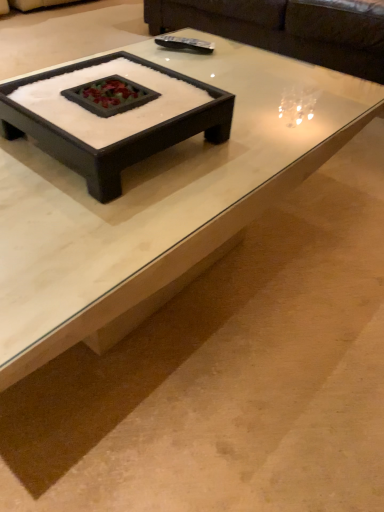
Question: Is dark brown leather couch at upper center oriented away from black matte tray at center, the second coffee table in the front-to-back sequence?

Choices:
 (A) yes
 (B) no

Answer: (B)

Question: Considering the relative sizes of dark brown leather couch at upper center and black matte tray at center, the second coffee table in the front-to-back sequence, in the image provided, is dark brown leather couch at upper center taller than black matte tray at center, the second coffee table in the front-to-back sequence,?

Choices:
 (A) yes
 (B) no

Answer: (A)

Question: Is dark brown leather couch at upper center closer to the viewer compared to black matte tray at center, the second coffee table in the front-to-back sequence?

Choices:
 (A) no
 (B) yes

Answer: (A)

Question: Does dark brown leather couch at upper center appear on the right side of black matte tray at center, placed as the 1th coffee table when sorted from back to front?

Choices:
 (A) no
 (B) yes

Answer: (B)

Question: Can you confirm if dark brown leather couch at upper center is thinner than black matte tray at center, the second coffee table in the front-to-back sequence?

Choices:
 (A) no
 (B) yes

Answer: (A)

Question: From a real-world perspective, is dark brown leather couch at upper center above or below white glossy coffee table at center, the 2th coffee table viewed from the back?

Choices:
 (A) below
 (B) above

Answer: (B)

Question: Is dark brown leather couch at upper center in front of or behind white glossy coffee table at center, the 2th coffee table viewed from the back, in the image?

Choices:
 (A) behind
 (B) front

Answer: (A)

Question: Looking at their shapes, would you say dark brown leather couch at upper center is wider or thinner than white glossy coffee table at center, the 2th coffee table viewed from the back?

Choices:
 (A) thin
 (B) wide

Answer: (B)

Question: Considering the positions of dark brown leather couch at upper center and white glossy coffee table at center, which appears as the first coffee table when viewed from the front, in the image, is dark brown leather couch at upper center bigger or smaller than white glossy coffee table at center, which appears as the first coffee table when viewed from the front,?

Choices:
 (A) small
 (B) big

Answer: (B)

Question: Is black matte tray at center, placed as the 1th coffee table when sorted from back to front, taller or shorter than dark brown leather couch at upper center?

Choices:
 (A) short
 (B) tall

Answer: (A)

Question: Does point (231, 112) appear closer or farther from the camera than point (190, 26)?

Choices:
 (A) farther
 (B) closer

Answer: (B)

Question: From a real-world perspective, is black matte tray at center, the second coffee table in the front-to-back sequence, positioned above or below dark brown leather couch at upper center?

Choices:
 (A) above
 (B) below

Answer: (A)

Question: Is black matte tray at center, the second coffee table in the front-to-back sequence, to the left or to the right of dark brown leather couch at upper center in the image?

Choices:
 (A) left
 (B) right

Answer: (A)

Question: Does point (370, 45) appear closer or farther from the camera than point (105, 189)?

Choices:
 (A) closer
 (B) farther

Answer: (B)

Question: Is dark brown leather couch at upper center taller or shorter than black matte tray at center, placed as the 1th coffee table when sorted from back to front?

Choices:
 (A) tall
 (B) short

Answer: (A)